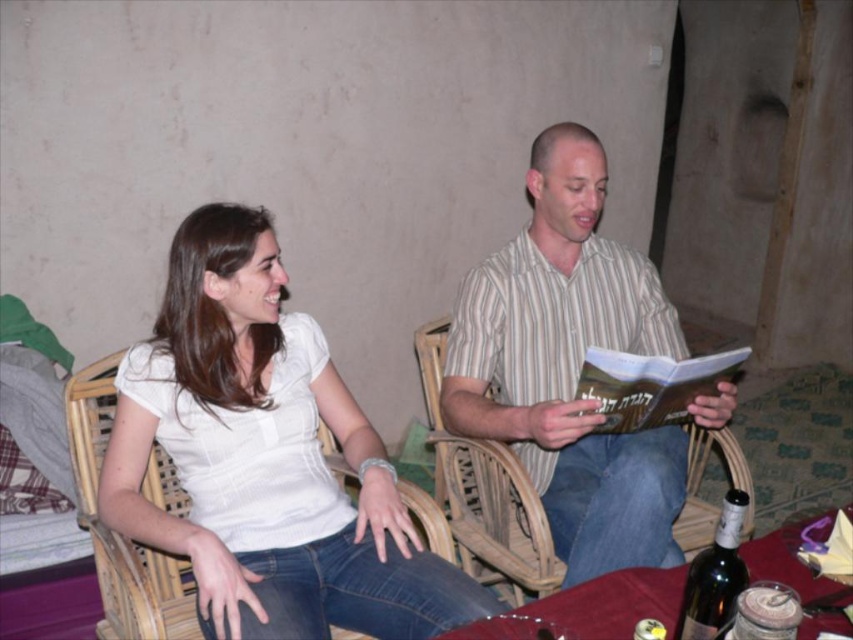
You are designing a storage box that needs to accommodate both the striped cotton shirt at center and the hardcover book at center. Given that the shirt is larger than the book, which item should you prioritize placing first to ensure both fit properly?

The striped cotton shirt at center has a larger size compared to the hardcover book at center, so you should place the striped cotton shirt at center first to ensure there is enough space for both items.

You are a photographer standing in front of the scene. You want to take a photo of both the striped cotton shirt at center and the hardcover book at center. The minimum distance between them should be 8 inches to ensure both are clearly visible. Can you capture them in one shot without moving any objects?

The striped cotton shirt at center and hardcover book at center are 7.71 inches apart, which is less than the required 8 inches. Therefore, you cannot capture both in one shot without moving any objects.

You are a photographer trying to capture a candid shot of both the white matte shirt at upper left and the striped cotton shirt at center. Since you want to ensure both subjects are fully visible in the frame, which shirt should you position your camera closer to?

The white matte shirt at upper left is positioned on the left side of striped cotton shirt at center, so to include both in the frame, the camera should be positioned closer to the white matte shirt at upper left to ensure the striped cotton shirt at center remains within the shot.